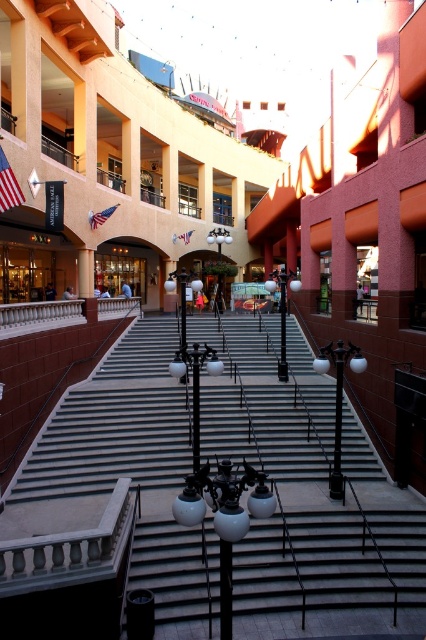
You are a maintenance worker tasked with replacing the american flag at upper left and the american flag at upper center. The distance between them is 37.03 feet. If you have a ladder that is 40 feet long, can you safely reach both flags without moving the ladder?

The distance between the american flag at upper left and the american flag at upper center is 37.03 feet. Since the ladder is 40 feet long, which is longer than the distance between them, you can safely reach both flags without moving the ladder.

You are standing at the bottom of the central staircase in the shopping center. You notice two points marked on the staircase. The first point is located at coordinates point (x=9, y=554) and the second point is at point (x=2, y=150). Which of these points is closer to your current position?

Point (x=9, y=554) is closer to the camera than point (x=2, y=150), so the first point is closer to your current position at the bottom of the staircase.